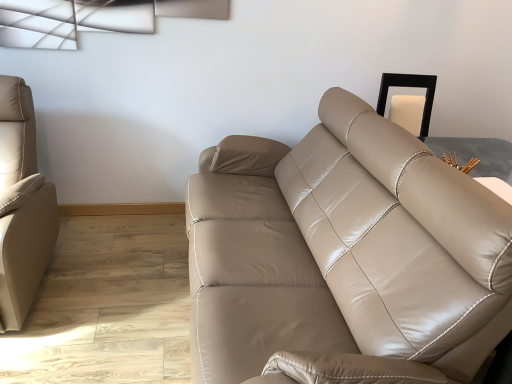
Describe the element at coordinates (344, 257) in the screenshot. I see `matte leather couch at center, which ranks as the 2th studio couch in left-to-right order` at that location.

Where is `matte leather couch at center, which ranks as the 2th studio couch in left-to-right order`? matte leather couch at center, which ranks as the 2th studio couch in left-to-right order is located at coordinates (344, 257).

The image size is (512, 384). What do you see at coordinates (22, 206) in the screenshot? I see `beige leather couch at left, marked as the 2th studio couch in a right-to-left arrangement` at bounding box center [22, 206].

Where is `beige leather couch at left, the 1th studio couch when ordered from left to right`? This screenshot has height=384, width=512. beige leather couch at left, the 1th studio couch when ordered from left to right is located at coordinates (22, 206).

In order to face beige leather couch at left, marked as the 2th studio couch in a right-to-left arrangement, should I rotate leftwards or rightwards?

It's best to rotate left around 30.901 degrees.

Identify the location of matte leather couch at center, which ranks as the 2th studio couch in left-to-right order. (344, 257).

Considering the positions of objects beige leather couch at left, marked as the 2th studio couch in a right-to-left arrangement, and matte leather couch at center, which ranks as the 2th studio couch in left-to-right order, in the image provided, who is more to the left, beige leather couch at left, marked as the 2th studio couch in a right-to-left arrangement, or matte leather couch at center, which ranks as the 2th studio couch in left-to-right order,?

beige leather couch at left, marked as the 2th studio couch in a right-to-left arrangement.

Which object is further away from the camera taking this photo, beige leather couch at left, the 1th studio couch when ordered from left to right, or matte leather couch at center, which ranks as the first studio couch in right-to-left order?

beige leather couch at left, the 1th studio couch when ordered from left to right, is more distant.

Which point is more forward, (44, 213) or (237, 215)?

The point (44, 213) is closer to the camera.

From the image's perspective, does beige leather couch at left, marked as the 2th studio couch in a right-to-left arrangement, appear lower than matte leather couch at center, which ranks as the first studio couch in right-to-left order?

No, from the image's perspective, beige leather couch at left, marked as the 2th studio couch in a right-to-left arrangement, is not below matte leather couch at center, which ranks as the first studio couch in right-to-left order.

From a real-world perspective, is beige leather couch at left, the 1th studio couch when ordered from left to right, on top of matte leather couch at center, which ranks as the first studio couch in right-to-left order?

No, from a real-world perspective, beige leather couch at left, the 1th studio couch when ordered from left to right, is not over matte leather couch at center, which ranks as the first studio couch in right-to-left order

Which of these two, beige leather couch at left, marked as the 2th studio couch in a right-to-left arrangement, or matte leather couch at center, which ranks as the first studio couch in right-to-left order, is wider?

Wider between the two is matte leather couch at center, which ranks as the first studio couch in right-to-left order.

Between beige leather couch at left, marked as the 2th studio couch in a right-to-left arrangement, and matte leather couch at center, which ranks as the 2th studio couch in left-to-right order, which one has more height?

With more height is beige leather couch at left, marked as the 2th studio couch in a right-to-left arrangement.

Does beige leather couch at left, marked as the 2th studio couch in a right-to-left arrangement, have a larger size compared to matte leather couch at center, which ranks as the first studio couch in right-to-left order?

Actually, beige leather couch at left, marked as the 2th studio couch in a right-to-left arrangement, might be smaller than matte leather couch at center, which ranks as the first studio couch in right-to-left order.

Is beige leather couch at left, the 1th studio couch when ordered from left to right, located outside matte leather couch at center, which ranks as the first studio couch in right-to-left order?

That's correct, beige leather couch at left, the 1th studio couch when ordered from left to right, is outside of matte leather couch at center, which ranks as the first studio couch in right-to-left order.

Is the surface of beige leather couch at left, marked as the 2th studio couch in a right-to-left arrangement, in direct contact with matte leather couch at center, which ranks as the 2th studio couch in left-to-right order?

No, beige leather couch at left, marked as the 2th studio couch in a right-to-left arrangement, is not touching matte leather couch at center, which ranks as the 2th studio couch in left-to-right order.

Is beige leather couch at left, the 1th studio couch when ordered from left to right, looking in the opposite direction of matte leather couch at center, which ranks as the 2th studio couch in left-to-right order?

beige leather couch at left, the 1th studio couch when ordered from left to right, is not turned away from matte leather couch at center, which ranks as the 2th studio couch in left-to-right order.

How many degrees apart are the facing directions of beige leather couch at left, the 1th studio couch when ordered from left to right, and matte leather couch at center, which ranks as the first studio couch in right-to-left order?

The angular difference between beige leather couch at left, the 1th studio couch when ordered from left to right, and matte leather couch at center, which ranks as the first studio couch in right-to-left order, is 91.4 degrees.

How much distance is there between beige leather couch at left, the 1th studio couch when ordered from left to right, and matte leather couch at center, which ranks as the first studio couch in right-to-left order?

beige leather couch at left, the 1th studio couch when ordered from left to right, and matte leather couch at center, which ranks as the first studio couch in right-to-left order, are 3.69 feet apart.

The height and width of the screenshot is (384, 512). In the image, there is a matte leather couch at center, which ranks as the first studio couch in right-to-left order. What are the coordinates of `studio couch below it (from a real-world perspective)` in the screenshot? It's located at (22, 206).

Can you confirm if matte leather couch at center, which ranks as the first studio couch in right-to-left order, is positioned to the left of beige leather couch at left, the 1th studio couch when ordered from left to right?

In fact, matte leather couch at center, which ranks as the first studio couch in right-to-left order, is to the right of beige leather couch at left, the 1th studio couch when ordered from left to right.

Which is in front, matte leather couch at center, which ranks as the first studio couch in right-to-left order, or beige leather couch at left, the 1th studio couch when ordered from left to right?

matte leather couch at center, which ranks as the first studio couch in right-to-left order, is more forward.

Which point is more distant from viewer, [460,278] or [40,192]?

The point [40,192] is behind.

From the image's perspective, would you say matte leather couch at center, which ranks as the 2th studio couch in left-to-right order, is positioned over beige leather couch at left, marked as the 2th studio couch in a right-to-left arrangement?

No, from the image's perspective, matte leather couch at center, which ranks as the 2th studio couch in left-to-right order, is not above beige leather couch at left, marked as the 2th studio couch in a right-to-left arrangement.

From a real-world perspective, does matte leather couch at center, which ranks as the first studio couch in right-to-left order, sit lower than beige leather couch at left, marked as the 2th studio couch in a right-to-left arrangement?

No, from a real-world perspective, matte leather couch at center, which ranks as the first studio couch in right-to-left order, is not below beige leather couch at left, marked as the 2th studio couch in a right-to-left arrangement.

Based on the photo, which of these two, matte leather couch at center, which ranks as the 2th studio couch in left-to-right order, or beige leather couch at left, the 1th studio couch when ordered from left to right, is thinner?

beige leather couch at left, the 1th studio couch when ordered from left to right.

Considering the relative sizes of matte leather couch at center, which ranks as the 2th studio couch in left-to-right order, and beige leather couch at left, marked as the 2th studio couch in a right-to-left arrangement, in the image provided, is matte leather couch at center, which ranks as the 2th studio couch in left-to-right order, taller than beige leather couch at left, marked as the 2th studio couch in a right-to-left arrangement,?

No, matte leather couch at center, which ranks as the 2th studio couch in left-to-right order, is not taller than beige leather couch at left, marked as the 2th studio couch in a right-to-left arrangement.

Based on their sizes in the image, would you say matte leather couch at center, which ranks as the 2th studio couch in left-to-right order, is bigger or smaller than beige leather couch at left, the 1th studio couch when ordered from left to right?

Considering their sizes, matte leather couch at center, which ranks as the 2th studio couch in left-to-right order, takes up more space than beige leather couch at left, the 1th studio couch when ordered from left to right.

Is matte leather couch at center, which ranks as the first studio couch in right-to-left order, inside the boundaries of beige leather couch at left, marked as the 2th studio couch in a right-to-left arrangement, or outside?

matte leather couch at center, which ranks as the first studio couch in right-to-left order, exists outside the volume of beige leather couch at left, marked as the 2th studio couch in a right-to-left arrangement.

Is matte leather couch at center, which ranks as the 2th studio couch in left-to-right order, with beige leather couch at left, the 1th studio couch when ordered from left to right?

No.

Is matte leather couch at center, which ranks as the 2th studio couch in left-to-right order, looking in the opposite direction of beige leather couch at left, marked as the 2th studio couch in a right-to-left arrangement?

No, matte leather couch at center, which ranks as the 2th studio couch in left-to-right order,'s orientation is not away from beige leather couch at left, marked as the 2th studio couch in a right-to-left arrangement.

Find the location of `studio couch below the matte leather couch at center, which ranks as the first studio couch in right-to-left order (from a real-world perspective)`. studio couch below the matte leather couch at center, which ranks as the first studio couch in right-to-left order (from a real-world perspective) is located at coordinates click(x=22, y=206).

I want to click on studio couch on the left of matte leather couch at center, which ranks as the first studio couch in right-to-left order, so pos(22,206).

This screenshot has width=512, height=384. Identify the location of studio couch that is below the beige leather couch at left, marked as the 2th studio couch in a right-to-left arrangement (from the image's perspective). (344, 257).